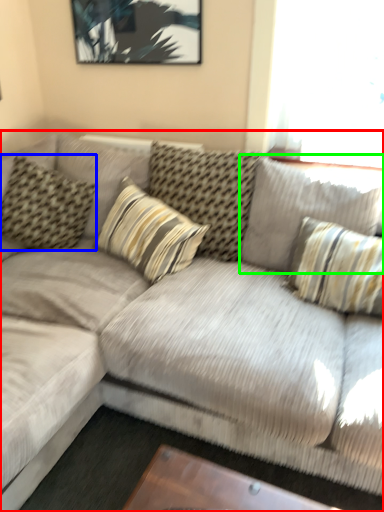
Question: Based on their relative distances, which object is farther from studio couch (highlighted by a red box)? Choose from pillow (highlighted by a blue box) and pillow (highlighted by a green box).

Choices:
 (A) pillow
 (B) pillow

Answer: (A)